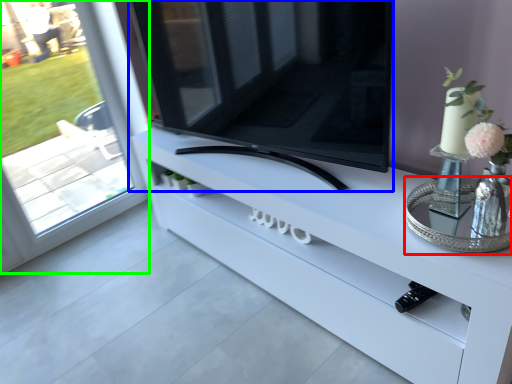
Question: Considering the real-world distances, which object is farthest from glass table (highlighted by a red box)? television (highlighted by a blue box) or window (highlighted by a green box)?

Choices:
 (A) television
 (B) window

Answer: (B)